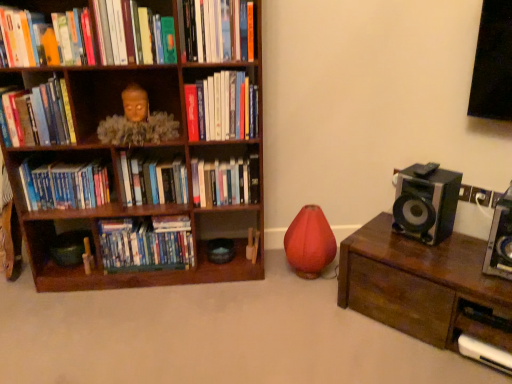
At what (x,y) coordinates should I click in order to perform the action: click on free point in front of brown wooden bookcase at left. Please return your answer as a coordinate pair (x, y). Looking at the image, I should click on (145, 327).